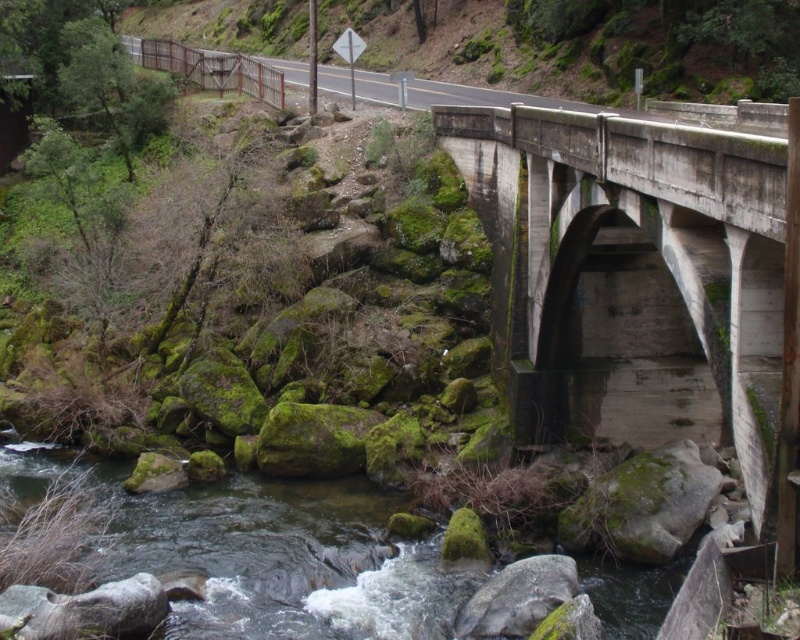
Question: Can you confirm if concrete at center is positioned to the right of green mossy rocks at upper left?

Choices:
 (A) no
 (B) yes

Answer: (B)

Question: Considering the real-world distances, which object is closest to the green mossy rocks at lower center?

Choices:
 (A) concrete at center
 (B) green mossy rocks at upper left

Answer: (A)

Question: Does concrete at center appear on the left side of green mossy rocks at lower center?

Choices:
 (A) no
 (B) yes

Answer: (A)

Question: Can you confirm if green mossy rocks at lower center is positioned to the right of green mossy rocks at upper left?

Choices:
 (A) yes
 (B) no

Answer: (A)

Question: Which of the following is the farthest from the observer?

Choices:
 (A) green mossy rocks at upper left
 (B) concrete at center

Answer: (A)

Question: Which point is farther from the camera taking this photo?

Choices:
 (A) (716, 172)
 (B) (636, 61)

Answer: (B)